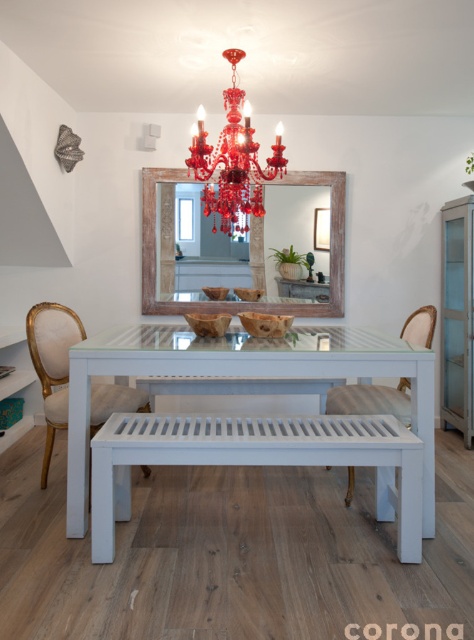
You are standing in the dining area and notice two points marked on the red chandelier. The first point is at coordinate point (x=358, y=342) and the second is at point (x=412, y=337). Which point appears closer to your viewpoint?

Point (x=358, y=342) is closer to the camera than point (x=412, y=337), so the first point appears closer to your viewpoint.

You are planning to place a large centerpiece on the white painted wood table at center. Considering the size of the shiny crystal chandelier at upper center, will there be enough space on the table for the centerpiece?

The white painted wood table at center has a larger size compared to the shiny crystal chandelier at upper center, so there should be sufficient space to place a large centerpiece on the table.

You are planning to hang a new light fixture in this dining area. The shiny crystal chandelier at upper center and the matte white chair at center are in the way. Which object would you need to move first to access the area above the table?

The shiny crystal chandelier at upper center is larger than the matte white chair at center, so you should move the shiny crystal chandelier at upper center first to access the area above the table.